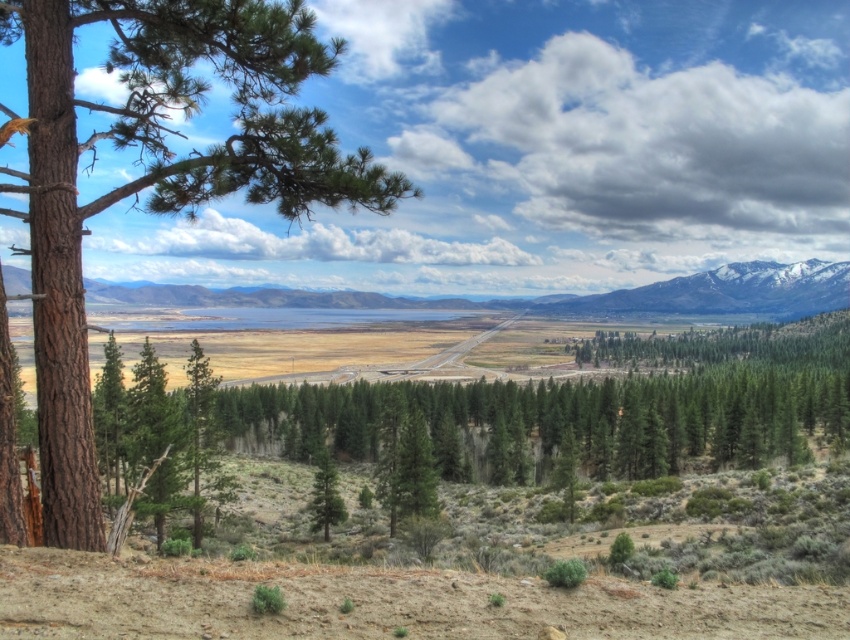
Who is more forward, (144, 100) or (735, 266)?

Point (144, 100)

Which is below, brown rough bark tree at left or snowy granite mountain at upper right?

snowy granite mountain at upper right is lower down.

Does point (58, 384) come in front of point (800, 301)?

That is True.

The width and height of the screenshot is (850, 640). I want to click on brown rough bark tree at left, so click(156, 173).

Is brown rough bark tree at left taller than green matte tree at center?

Yes, brown rough bark tree at left is taller than green matte tree at center.

Can you confirm if brown rough bark tree at left is shorter than green matte tree at center?

No, brown rough bark tree at left is not shorter than green matte tree at center.

Locate an element on the screen. brown rough bark tree at left is located at coordinates (156, 173).

Does snowy granite mountain at upper right appear under green matte tree at center?

No.

Is snowy granite mountain at upper right to the left of green matte tree at center from the viewer's perspective?

In fact, snowy granite mountain at upper right is to the right of green matte tree at center.

Identify the location of snowy granite mountain at upper right. (726, 291).

Where is `snowy granite mountain at upper right`? The image size is (850, 640). snowy granite mountain at upper right is located at coordinates (726, 291).